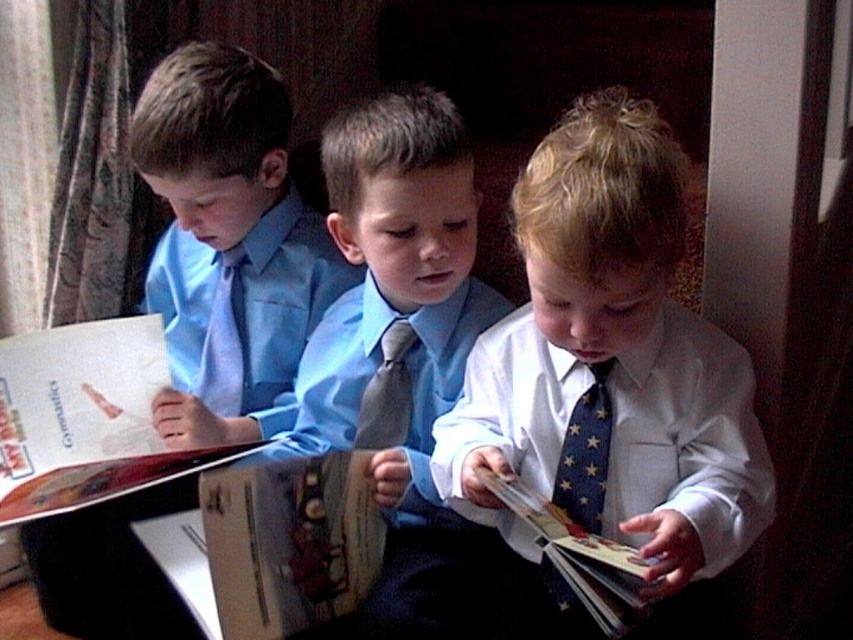
Question: Which of the following is the farthest from the observer?

Choices:
 (A) (534, 499)
 (B) (585, 396)
 (C) (73, 403)
 (D) (190, 568)

Answer: (C)

Question: Considering the real-world distances, which object is closest to the hardcover book at center?

Choices:
 (A) dark gray textured tie at center
 (B) matte paper book at left

Answer: (B)

Question: Which point is farther to the camera?

Choices:
 (A) (x=369, y=486)
 (B) (x=389, y=432)
 (C) (x=210, y=388)
 (D) (x=646, y=410)

Answer: (C)

Question: Can you confirm if blue fabric book at center is thinner than matte blue tie at left?

Choices:
 (A) yes
 (B) no

Answer: (B)

Question: Can you confirm if white glossy shirt at center is positioned below dark gray textured tie at center?

Choices:
 (A) yes
 (B) no

Answer: (B)

Question: Does matte paper book at left appear over dark gray textured tie at center?

Choices:
 (A) yes
 (B) no

Answer: (B)